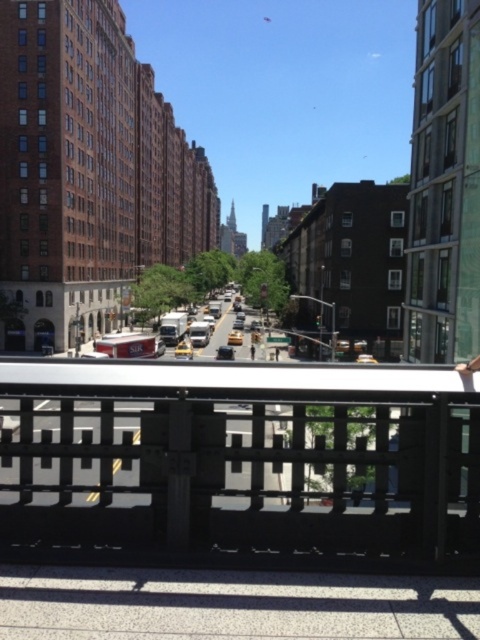
Does black metal fence at lower center appear under gray concrete pavement at lower center?

Yes, black metal fence at lower center is below gray concrete pavement at lower center.

Is point (37, 524) in front of point (129, 588)?

That is False.

Where is `black metal fence at lower center`? The width and height of the screenshot is (480, 640). black metal fence at lower center is located at coordinates (x=240, y=465).